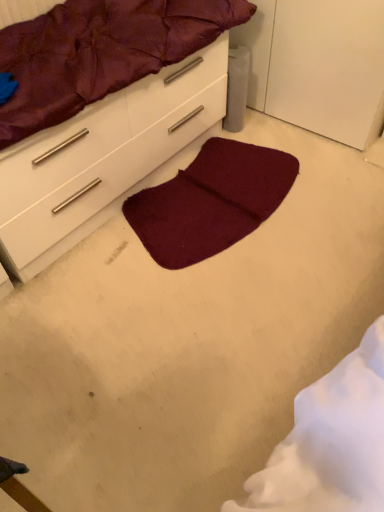
Question: Does burgundy plush mat at center come in front of matte white chest of drawers at center?

Choices:
 (A) no
 (B) yes

Answer: (A)

Question: Is burgundy plush mat at center in contact with matte white chest of drawers at center?

Choices:
 (A) yes
 (B) no

Answer: (B)

Question: Does burgundy plush mat at center have a larger size compared to matte white chest of drawers at center?

Choices:
 (A) yes
 (B) no

Answer: (B)

Question: Can you confirm if burgundy plush mat at center is positioned to the left of matte white chest of drawers at center?

Choices:
 (A) yes
 (B) no

Answer: (B)

Question: From the image's perspective, is burgundy plush mat at center under matte white chest of drawers at center?

Choices:
 (A) yes
 (B) no

Answer: (A)

Question: Is matte white chest of drawers at center at the back of burgundy plush mat at center?

Choices:
 (A) no
 (B) yes

Answer: (B)

Question: Is matte white chest of drawers at center at the right side of burgundy fabric mattress at upper center?

Choices:
 (A) no
 (B) yes

Answer: (A)

Question: Does matte white chest of drawers at center turn towards burgundy fabric mattress at upper center?

Choices:
 (A) no
 (B) yes

Answer: (A)

Question: Is burgundy fabric mattress at upper center at the back of matte white chest of drawers at center?

Choices:
 (A) no
 (B) yes

Answer: (A)

Question: Is matte white chest of drawers at center not near burgundy fabric mattress at upper center?

Choices:
 (A) no
 (B) yes

Answer: (A)

Question: Is matte white chest of drawers at center beside burgundy fabric mattress at upper center?

Choices:
 (A) yes
 (B) no

Answer: (B)

Question: Is matte white chest of drawers at center thinner than burgundy fabric mattress at upper center?

Choices:
 (A) no
 (B) yes

Answer: (A)

Question: From the image's perspective, does matte white chest of drawers at center appear higher than burgundy plush mat at center?

Choices:
 (A) no
 (B) yes

Answer: (B)